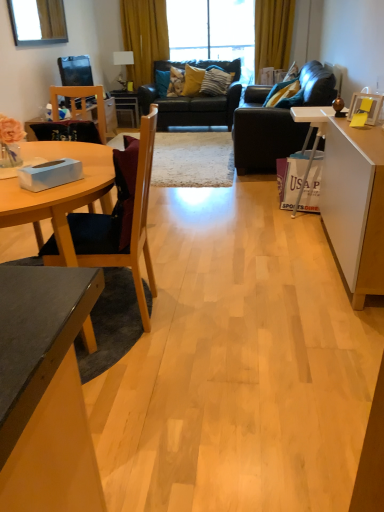
Question: Is dark brown leather couch at right, the 2th studio couch in the back-to-front sequence, smaller than velvet yellow pillow at center, acting as the fourth pillow starting from the front?

Choices:
 (A) yes
 (B) no

Answer: (B)

Question: Is dark brown leather couch at right, the first studio couch positioned from the front, taller than velvet yellow pillow at center, acting as the first pillow starting from the left?

Choices:
 (A) no
 (B) yes

Answer: (B)

Question: Are dark brown leather couch at right, the first studio couch positioned from the front, and velvet yellow pillow at center, acting as the first pillow starting from the left, making contact?

Choices:
 (A) no
 (B) yes

Answer: (A)

Question: From a real-world perspective, is dark brown leather couch at right, the first studio couch positioned from the front, physically above velvet yellow pillow at center, acting as the fourth pillow starting from the front?

Choices:
 (A) yes
 (B) no

Answer: (B)

Question: Would you consider dark brown leather couch at right, the 2th studio couch in the back-to-front sequence, to be distant from velvet yellow pillow at center, which is counted as the first pillow, starting from the back?

Choices:
 (A) no
 (B) yes

Answer: (B)

Question: Considering the relative positions of dark brown leather couch at right, the 2th studio couch in the back-to-front sequence, and velvet yellow pillow at center, which is counted as the first pillow, starting from the back, in the image provided, is dark brown leather couch at right, the 2th studio couch in the back-to-front sequence, to the right of velvet yellow pillow at center, which is counted as the first pillow, starting from the back, from the viewer's perspective?

Choices:
 (A) yes
 (B) no

Answer: (A)

Question: From a real-world perspective, is yellow fabric curtain at upper center, which ranks as the 1th curtain in right-to-left order, positioned under velvet blue pillow at upper right, positioned as the 1th pillow in front-to-back order, based on gravity?

Choices:
 (A) no
 (B) yes

Answer: (A)

Question: Can you confirm if yellow fabric curtain at upper center, which ranks as the 1th curtain in right-to-left order, is smaller than velvet blue pillow at upper right, which is the 4th pillow from back to front?

Choices:
 (A) no
 (B) yes

Answer: (A)

Question: From the image's perspective, is yellow fabric curtain at upper center, which ranks as the 1th curtain in right-to-left order, over velvet blue pillow at upper right, positioned as the 1th pillow in front-to-back order?

Choices:
 (A) no
 (B) yes

Answer: (B)

Question: Is yellow fabric curtain at upper center, which ranks as the 1th curtain in right-to-left order, bigger than velvet blue pillow at upper right, positioned as the 1th pillow in front-to-back order?

Choices:
 (A) no
 (B) yes

Answer: (B)

Question: Considering the relative positions of yellow fabric curtain at upper center, which ranks as the 1th curtain in right-to-left order, and velvet blue pillow at upper right, the 4th pillow viewed from the left, in the image provided, is yellow fabric curtain at upper center, which ranks as the 1th curtain in right-to-left order, behind velvet blue pillow at upper right, the 4th pillow viewed from the left,?

Choices:
 (A) yes
 (B) no

Answer: (A)

Question: Can you confirm if yellow fabric curtain at upper center, the second curtain viewed from the left, is wider than velvet blue pillow at upper right, which is the 4th pillow from back to front?

Choices:
 (A) no
 (B) yes

Answer: (B)

Question: Is velvet blue pillow at upper right, which is the 4th pillow from back to front, at the back of matte white lamp at upper center?

Choices:
 (A) yes
 (B) no

Answer: (B)